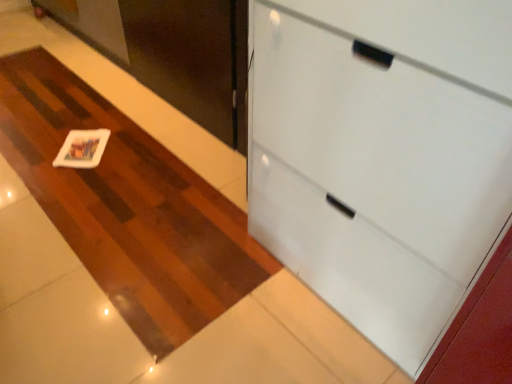
What do you see at coordinates (82, 149) in the screenshot? This screenshot has width=512, height=384. I see `white matte card at center` at bounding box center [82, 149].

Image resolution: width=512 pixels, height=384 pixels. Describe the element at coordinates (193, 59) in the screenshot. I see `matte black door at upper left` at that location.

Locate an element on the screen. white glossy cabinet at upper right is located at coordinates (382, 156).

From a real-world perspective, is matte black door at upper left physically below white glossy cabinet at upper right?

Yes.

Is matte black door at upper left smaller than white glossy cabinet at upper right?

Result: Yes.

Which of these two, matte black door at upper left or white glossy cabinet at upper right, stands taller?

white glossy cabinet at upper right.

Is white matte card at center located outside white glossy cabinet at upper right?

white matte card at center is positioned outside white glossy cabinet at upper right.

Where is `cabinetry lying on the right of white matte card at center`? cabinetry lying on the right of white matte card at center is located at coordinates (382, 156).

In the image, is white matte card at center positioned in front of or behind white glossy cabinet at upper right?

Clearly, white matte card at center is behind white glossy cabinet at upper right.

Which is behind, point (39, 130) or point (177, 74)?

The point (39, 130) is behind.

Can you confirm if white matte coaster at center is positioned to the right of matte black door at upper left?

In fact, white matte coaster at center is to the left of matte black door at upper left.

In the scene shown: From the image's perspective, which one is positioned lower, white matte coaster at center or matte black door at upper left?

white matte coaster at center, from the image's perspective.

Is there a large distance between white matte coaster at center and matte black door at upper left?

That's not correct — white matte coaster at center is a little close to matte black door at upper left.

Looking at this image, does white glossy cabinet at upper right appear on the right side of white matte card at center?

Correct, you'll find white glossy cabinet at upper right to the right of white matte card at center.

Which is in front, point (266, 221) or point (97, 155)?

Positioned in front is point (266, 221).

Is the surface of white glossy cabinet at upper right in direct contact with white matte card at center?

No, white glossy cabinet at upper right is not in contact with white matte card at center.

What's the angular difference between white matte card at center and matte black door at upper left's facing directions?

48.3 degrees separate the facing orientations of white matte card at center and matte black door at upper left.

Does white matte card at center have a lesser height compared to matte black door at upper left?

Yes.

In the scene shown: Is white matte card at center far away from matte black door at upper left?

Actually, white matte card at center and matte black door at upper left are a little close together.

This screenshot has width=512, height=384. In the image, there is a matte black door at upper left. What are the coordinates of `card below it (from a real-world perspective)` in the screenshot? It's located at (82, 149).

Does matte black door at upper left have a greater width compared to white matte card at center?

No.

Is white matte card at center at the back of matte black door at upper left?

That's not correct — matte black door at upper left is not looking away from white matte card at center.

Is matte black door at upper left in front of or behind white matte card at center in the image?

Visually, matte black door at upper left is located in front of white matte card at center.

Does matte black door at upper left touch white matte card at center?

No.

Which object is further away from the camera taking this photo, white glossy cabinet at upper right or matte black door at upper left?

matte black door at upper left is behind.

Considering the relative sizes of white glossy cabinet at upper right and matte black door at upper left in the image provided, is white glossy cabinet at upper right taller than matte black door at upper left?

Indeed, white glossy cabinet at upper right has a greater height compared to matte black door at upper left.

Considering the relative sizes of white glossy cabinet at upper right and matte black door at upper left in the image provided, is white glossy cabinet at upper right smaller than matte black door at upper left?

No, white glossy cabinet at upper right is not smaller than matte black door at upper left.

Locate an element on the screen. Image resolution: width=512 pixels, height=384 pixels. cabinetry that is on the right side of matte black door at upper left is located at coordinates (382, 156).

Identify the location of card above the white glossy cabinet at upper right (from the image's perspective). The image size is (512, 384). pos(82,149).

Considering their positions, is matte black door at upper left positioned further to white glossy cabinet at upper right than white matte coaster at center?

matte black door at upper left is further to white glossy cabinet at upper right.

Considering their positions, is white matte card at center positioned further to white glossy cabinet at upper right than matte black door at upper left?

Based on the image, white matte card at center appears to be further to white glossy cabinet at upper right.

In the scene shown: Which object lies further to the anchor point white glossy cabinet at upper right, white matte coaster at center or matte black door at upper left?

Based on the image, matte black door at upper left appears to be further to white glossy cabinet at upper right.

Estimate the real-world distances between objects in this image. Which object is further from white glossy cabinet at upper right, white matte card at center or white matte coaster at center?

white matte card at center.

Which object lies further to the anchor point matte black door at upper left, white matte coaster at center or white glossy cabinet at upper right?

Based on the image, white glossy cabinet at upper right appears to be further to matte black door at upper left.

Based on their spatial positions, is matte black door at upper left or white matte card at center closer to white matte coaster at center?

Based on the image, white matte card at center appears to be nearer to white matte coaster at center.

From the image, which object appears to be nearer to white matte card at center, white matte coaster at center or matte black door at upper left?

white matte coaster at center lies closer to white matte card at center than the other object.

Looking at the image, which one is located closer to matte black door at upper left, white glossy cabinet at upper right or white matte coaster at center?

Based on the image, white matte coaster at center appears to be nearer to matte black door at upper left.

I want to click on door between white matte coaster at center and white glossy cabinet at upper right, so click(193, 59).

This screenshot has height=384, width=512. Identify the location of door between white glossy cabinet at upper right and white matte card at center from front to back. (193, 59).

Locate an element on the screen. door between white matte coaster at center and white matte card at center along the z-axis is located at coordinates (193, 59).

You are a GUI agent. You are given a task and a screenshot of the screen. Output one action in this format:
    pyautogui.click(x=<x>, y=<y>)
    Task: Click on the plain between white glossy cabinet at upper right and white matte card at center from front to back
    The image size is (512, 384).
    Given the screenshot: What is the action you would take?
    pyautogui.click(x=128, y=207)